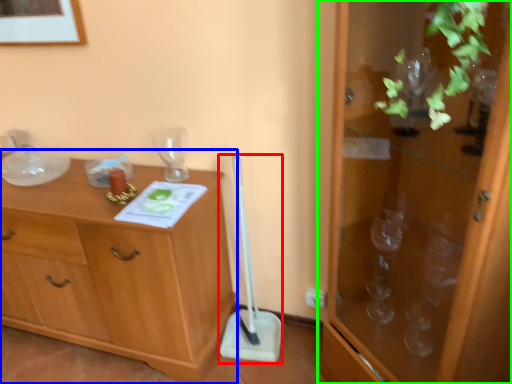
Question: Considering the real-world distances, which object is farthest from shovel (highlighted by a red box)? chest of drawers (highlighted by a blue box) or cabinetry (highlighted by a green box)?

Choices:
 (A) chest of drawers
 (B) cabinetry

Answer: (B)